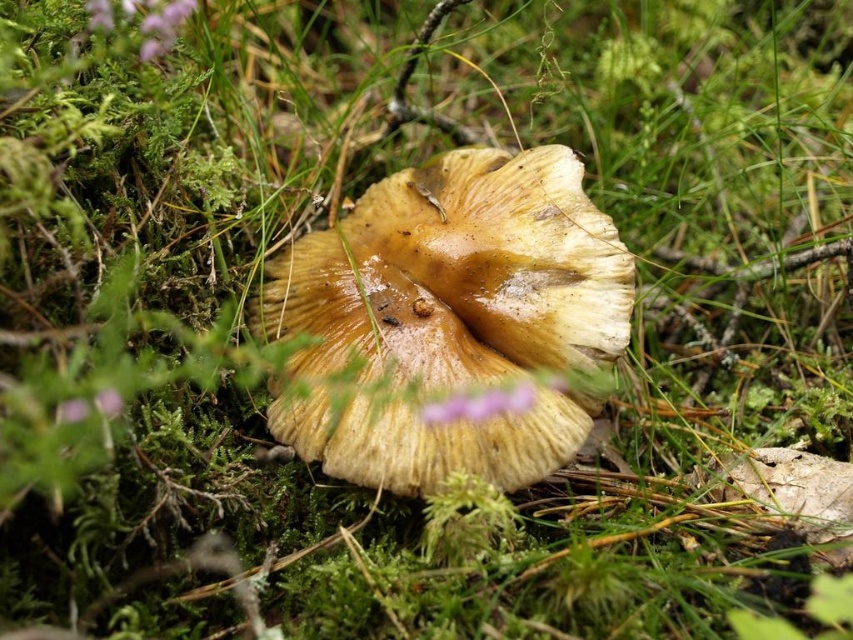
Is brown textured mushroom at center above purple matte flower at upper left?

Actually, brown textured mushroom at center is below purple matte flower at upper left.

The height and width of the screenshot is (640, 853). I want to click on brown textured mushroom at center, so click(x=457, y=275).

The image size is (853, 640). What are the coordinates of `brown textured mushroom at center` in the screenshot? It's located at (457, 275).